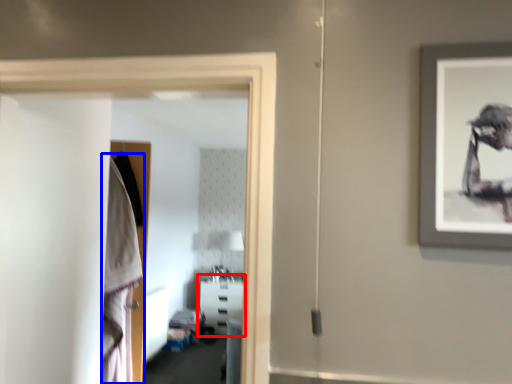
Question: Which object is closer to the camera taking this photo, furniture (highlighted by a red box) or robe (highlighted by a blue box)?

Choices:
 (A) furniture
 (B) robe

Answer: (B)